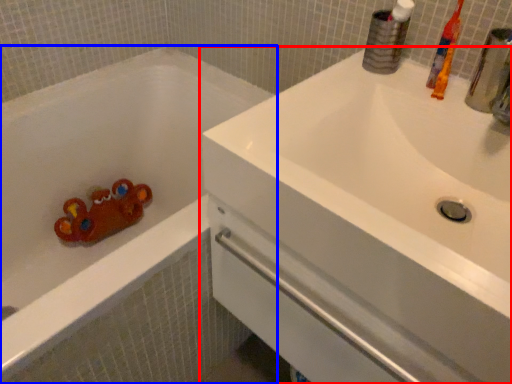
Question: Which of the following is the closest to the observer, sink (highlighted by a red box) or bathtub (highlighted by a blue box)?

Choices:
 (A) sink
 (B) bathtub

Answer: (A)